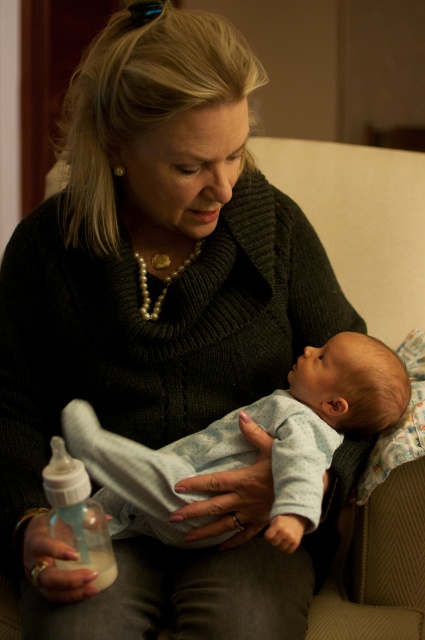
You are a photographer setting up for a family portrait. You need to position the light blue soft fabric baby at center and the translucent plastic bottle at lower left in the frame. Based on their current positions, which object is closer to the right edge of the photo?

The light blue soft fabric baby at center is positioned on the right side of the translucent plastic bottle at lower left, so it is closer to the right edge of the photo.